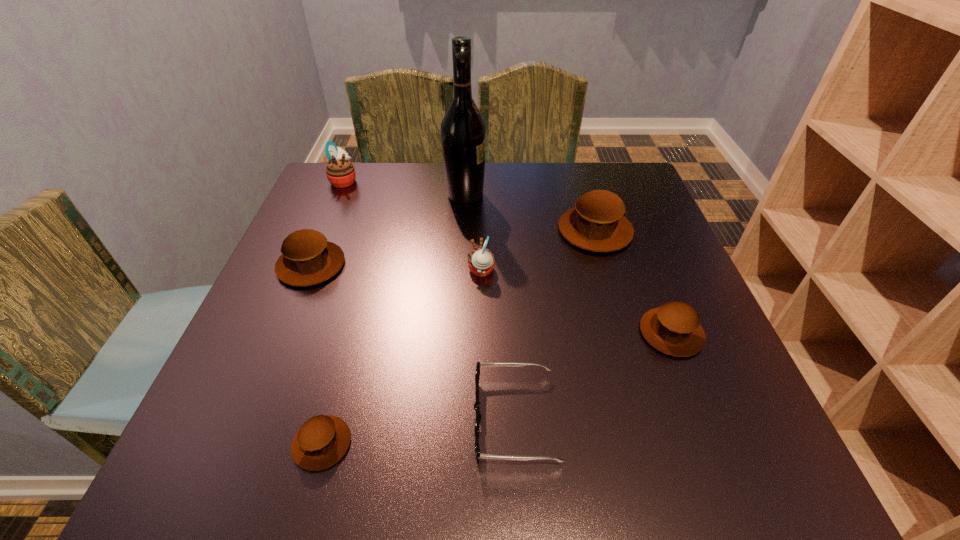
What are the coordinates of `the closest brown muffin to the tallest object` in the screenshot? It's located at (596, 223).

The width and height of the screenshot is (960, 540). Identify the location of blank space that satisfies the following two spatial constraints: 1. on the front-facing side of the farthest muffin; 2. on the left side of the leftmost brown muffin. (309, 265).

This screenshot has width=960, height=540. In order to click on blank area in the image that satisfies the following two spatial constraints: 1. on the front-facing side of the biggest brown muffin; 2. on the left side of the farther pink muffin in this screenshot , I will do `click(324, 231)`.

Locate an element on the screen. free space in the image that satisfies the following two spatial constraints: 1. on the front-facing side of the third smallest brown muffin; 2. on the right side of the farther pink muffin is located at coordinates (309, 265).

The width and height of the screenshot is (960, 540). Find the location of `free spot that satisfies the following two spatial constraints: 1. on the front-facing side of the third nearest object; 2. on the left side of the smaller pink muffin`. free spot that satisfies the following two spatial constraints: 1. on the front-facing side of the third nearest object; 2. on the left side of the smaller pink muffin is located at coordinates (481, 333).